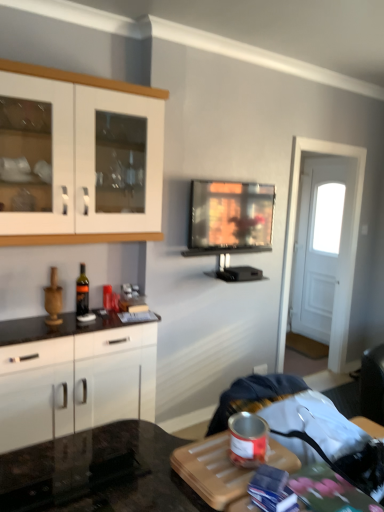
The height and width of the screenshot is (512, 384). What do you see at coordinates (75, 382) in the screenshot? I see `white glossy cabinet at left, which ranks as the 1th cabinetry in bottom-to-top order` at bounding box center [75, 382].

At what (x,y) coordinates should I click in order to perform the action: click on white wooden door at right. Please return your answer as a coordinate pair (x, y). Looking at the image, I should click on (322, 243).

Image resolution: width=384 pixels, height=512 pixels. What do you see at coordinates (230, 217) in the screenshot?
I see `flat screen tv at center` at bounding box center [230, 217].

The height and width of the screenshot is (512, 384). What are the coordinates of `white glossy cabinet at upper left, the first cabinetry positioned from the top` in the screenshot? It's located at (85, 81).

Identify the location of white glossy cabinet at left, which ranks as the 1th cabinetry in bottom-to-top order. (75, 382).

Is point (132, 410) farther from viewer compared to point (313, 162)?

No, it is not.

Can you confirm if white glossy cabinet at left, which ranks as the 1th cabinetry in bottom-to-top order, is smaller than white wooden door at right?

No, white glossy cabinet at left, which ranks as the 1th cabinetry in bottom-to-top order, is not smaller than white wooden door at right.

Does white glossy cabinet at left, marked as the 2th cabinetry in a top-to-bottom arrangement, turn towards white wooden door at right?

No, white glossy cabinet at left, marked as the 2th cabinetry in a top-to-bottom arrangement, is not oriented towards white wooden door at right.

From the image's perspective, is white glossy cabinet at left, marked as the 2th cabinetry in a top-to-bottom arrangement, below white wooden door at right?

Yes.

Does white wooden door at right come in front of white glossy cabinet at left, marked as the 2th cabinetry in a top-to-bottom arrangement?

No, white wooden door at right is further to the viewer.

Can you confirm if white wooden door at right is shorter than white glossy cabinet at left, marked as the 2th cabinetry in a top-to-bottom arrangement?

No, white wooden door at right is not shorter than white glossy cabinet at left, marked as the 2th cabinetry in a top-to-bottom arrangement.

Is white glossy cabinet at left, which ranks as the 1th cabinetry in bottom-to-top order, a part of white wooden door at right?

No, white glossy cabinet at left, which ranks as the 1th cabinetry in bottom-to-top order, is not a part of white wooden door at right.

From the picture: Is white wooden door at right positioned far away from white glossy cabinet at left, which ranks as the 1th cabinetry in bottom-to-top order?

white wooden door at right is far away from white glossy cabinet at left, which ranks as the 1th cabinetry in bottom-to-top order.

Is flat screen tv at center thinner than white wooden door at right?

No, flat screen tv at center is not thinner than white wooden door at right.

Can you see flat screen tv at center touching white wooden door at right?

No, flat screen tv at center is not touching white wooden door at right.

From the image's perspective, between flat screen tv at center and white wooden door at right, who is located below?

white wooden door at right appears lower in the image.

Can white wooden door at right be found inside flat screen tv at center?

No, white wooden door at right is not surrounded by flat screen tv at center.

Is white wooden door at right looking in the opposite direction of white glossy cabinet at upper left, marked as the 2th cabinetry in a bottom-to-top arrangement?

No, white wooden door at right's orientation is not away from white glossy cabinet at upper left, marked as the 2th cabinetry in a bottom-to-top arrangement.

Is white wooden door at right positioned beyond the bounds of white glossy cabinet at upper left, the first cabinetry positioned from the top?

Absolutely, white wooden door at right is external to white glossy cabinet at upper left, the first cabinetry positioned from the top.

From the image's perspective, does white wooden door at right appear lower than white glossy cabinet at upper left, the first cabinetry positioned from the top?

Indeed, from the image's perspective, white wooden door at right is shown beneath white glossy cabinet at upper left, the first cabinetry positioned from the top.

Which of these two, white wooden door at right or white glossy cabinet at upper left, marked as the 2th cabinetry in a bottom-to-top arrangement, is thinner?

Thinner between the two is white wooden door at right.

From a real-world perspective, which is physically below, white glossy cabinet at upper left, the first cabinetry positioned from the top, or white wooden door at right?

white wooden door at right is physically lower.

Is point (81, 83) farther from viewer compared to point (322, 159)?

No, (81, 83) is in front of (322, 159).

Considering the relative sizes of white glossy cabinet at upper left, the first cabinetry positioned from the top, and white wooden door at right in the image provided, is white glossy cabinet at upper left, the first cabinetry positioned from the top, taller than white wooden door at right?

In fact, white glossy cabinet at upper left, the first cabinetry positioned from the top, may be shorter than white wooden door at right.

You are a GUI agent. You are given a task and a screenshot of the screen. Output one action in this format:
    pyautogui.click(x=<x>, y=<y>)
    Task: Click on the 2nd cabinetry in front of the white wooden door at right, counting from the anchor's position
    
    Given the screenshot: What is the action you would take?
    pyautogui.click(x=85, y=81)

Identify the location of television positioned vertically above the white wooden door at right (from a real-world perspective). (230, 217).

From the image's perspective, is white wooden door at right located beneath flat screen tv at center?

Yes.

Does white wooden door at right have a greater height compared to flat screen tv at center?

Indeed, white wooden door at right has a greater height compared to flat screen tv at center.

Is white wooden door at right positioned far away from flat screen tv at center?

Yes, white wooden door at right is far from flat screen tv at center.

From a real-world perspective, is white glossy cabinet at upper left, marked as the 2th cabinetry in a bottom-to-top arrangement, positioned over white glossy cabinet at left, marked as the 2th cabinetry in a top-to-bottom arrangement, based on gravity?

Yes.

Considering the positions of objects white glossy cabinet at upper left, marked as the 2th cabinetry in a bottom-to-top arrangement, and white glossy cabinet at left, which ranks as the 1th cabinetry in bottom-to-top order, in the image provided, who is more to the left, white glossy cabinet at upper left, marked as the 2th cabinetry in a bottom-to-top arrangement, or white glossy cabinet at left, which ranks as the 1th cabinetry in bottom-to-top order,?

white glossy cabinet at left, which ranks as the 1th cabinetry in bottom-to-top order.

Which object is further away from the camera, white glossy cabinet at upper left, the first cabinetry positioned from the top, or white glossy cabinet at left, marked as the 2th cabinetry in a top-to-bottom arrangement?

white glossy cabinet at left, marked as the 2th cabinetry in a top-to-bottom arrangement.

Measure the distance between white glossy cabinet at upper left, the first cabinetry positioned from the top, and white glossy cabinet at left, which ranks as the 1th cabinetry in bottom-to-top order.

They are 30.48 inches apart.

At what (x,y) coordinates should I click in order to perform the action: click on the 2nd cabinetry to the left when counting from the white wooden door at right. Please return your answer as a coordinate pair (x, y). Image resolution: width=384 pixels, height=512 pixels. Looking at the image, I should click on (75, 382).

Image resolution: width=384 pixels, height=512 pixels. What are the coordinates of `cabinetry located underneath the white wooden door at right (from a real-world perspective)` in the screenshot? It's located at (75, 382).

Which object lies nearer to the anchor point flat screen tv at center, white glossy cabinet at left, marked as the 2th cabinetry in a top-to-bottom arrangement, or white wooden door at right?

Among the two, white glossy cabinet at left, marked as the 2th cabinetry in a top-to-bottom arrangement, is located nearer to flat screen tv at center.

Estimate the real-world distances between objects in this image. Which object is closer to flat screen tv at center, white wooden door at right or white glossy cabinet at left, which ranks as the 1th cabinetry in bottom-to-top order?

white glossy cabinet at left, which ranks as the 1th cabinetry in bottom-to-top order, is closer to flat screen tv at center.

Estimate the real-world distances between objects in this image. Which object is further from white glossy cabinet at upper left, the first cabinetry positioned from the top, flat screen tv at center or white glossy cabinet at left, marked as the 2th cabinetry in a top-to-bottom arrangement?

white glossy cabinet at left, marked as the 2th cabinetry in a top-to-bottom arrangement.

Estimate the real-world distances between objects in this image. Which object is closer to flat screen tv at center, white glossy cabinet at left, which ranks as the 1th cabinetry in bottom-to-top order, or white glossy cabinet at upper left, the first cabinetry positioned from the top?

The object closer to flat screen tv at center is white glossy cabinet at upper left, the first cabinetry positioned from the top.

Considering their positions, is white glossy cabinet at upper left, marked as the 2th cabinetry in a bottom-to-top arrangement, positioned closer to flat screen tv at center than white glossy cabinet at left, which ranks as the 1th cabinetry in bottom-to-top order?

Based on the image, white glossy cabinet at upper left, marked as the 2th cabinetry in a bottom-to-top arrangement, appears to be nearer to flat screen tv at center.

From the image, which object appears to be nearer to white glossy cabinet at left, which ranks as the 1th cabinetry in bottom-to-top order, white wooden door at right or flat screen tv at center?

Among the two, flat screen tv at center is located nearer to white glossy cabinet at left, which ranks as the 1th cabinetry in bottom-to-top order.

Based on their spatial positions, is white glossy cabinet at left, which ranks as the 1th cabinetry in bottom-to-top order, or flat screen tv at center closer to white glossy cabinet at upper left, the first cabinetry positioned from the top?

Among the two, flat screen tv at center is located nearer to white glossy cabinet at upper left, the first cabinetry positioned from the top.

Considering their positions, is flat screen tv at center positioned further to white wooden door at right than white glossy cabinet at upper left, the first cabinetry positioned from the top?

The object further to white wooden door at right is white glossy cabinet at upper left, the first cabinetry positioned from the top.

Find the location of `television between white glossy cabinet at upper left, marked as the 2th cabinetry in a bottom-to-top arrangement, and white wooden door at right in the front-back direction`. television between white glossy cabinet at upper left, marked as the 2th cabinetry in a bottom-to-top arrangement, and white wooden door at right in the front-back direction is located at coordinates (230, 217).

The height and width of the screenshot is (512, 384). In order to click on television between white glossy cabinet at left, marked as the 2th cabinetry in a top-to-bottom arrangement, and white wooden door at right, along the z-axis in this screenshot , I will do `click(230, 217)`.

Locate an element on the screen. The image size is (384, 512). television between white glossy cabinet at upper left, marked as the 2th cabinetry in a bottom-to-top arrangement, and white glossy cabinet at left, marked as the 2th cabinetry in a top-to-bottom arrangement, in the up-down direction is located at coordinates (230, 217).

Where is `cabinetry between white glossy cabinet at upper left, the first cabinetry positioned from the top, and white wooden door at right in the front-back direction`? The height and width of the screenshot is (512, 384). cabinetry between white glossy cabinet at upper left, the first cabinetry positioned from the top, and white wooden door at right in the front-back direction is located at coordinates (75, 382).